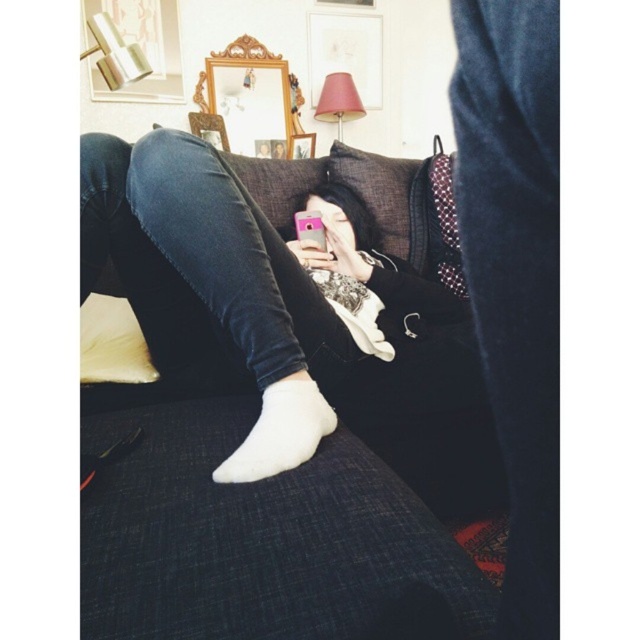
You are a delivery robot entering the room and need to place a package on the dark fabric couch at center or the white cotton sock at lower center. Which surface can accommodate the package based on their sizes?

The dark fabric couch at center has a greater width than the white cotton sock at lower center, so the package should be placed on the dark fabric couch at center as it can accommodate the package size better.

You are a delivery robot entering the room and need to place a package on the floor near the white cotton sock at lower center. According to the coordinates provided, where should you place the package?

The package should be placed near the coordinates point (280,432) where the white cotton sock at lower center is located.

You are standing in the room and want to place a small vase on the dark fabric couch at center. However, you notice the white fabric pillow at left. Is the couch in front of the pillow or behind it?

The dark fabric couch at center is in front of the white fabric pillow at left, so placing the vase on the couch would mean it is in front of the pillow.